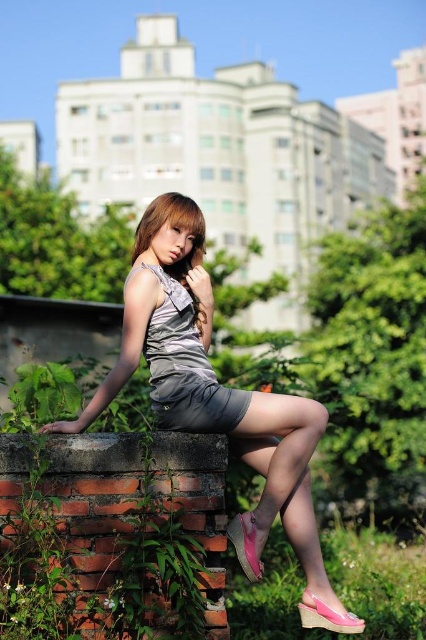
From the picture: You are a fashion designer observing two dresses in an urban setting. The scene includes a satin gray dress at center and a satin silver dress at center. Which dress is closer to the camera?

The satin gray dress at center is closer to the camera than the satin silver dress at center because the distance between them is 84.95 centimeters.

You are a photographer planning to capture the scene of the young woman wearing the satin dress at center and the satin silver dress at center. Which dress would require more space in the frame to fully capture its details?

The satin silver dress at center requires more space in the frame because it occupies more space than the satin dress at center according to the description.